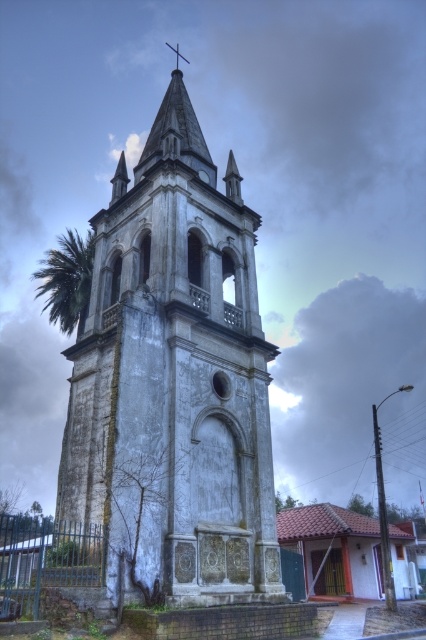
Question: Is green leafy palm at left above metallic cross at upper center?

Choices:
 (A) no
 (B) yes

Answer: (A)

Question: Which of the following is the farthest from the observer?

Choices:
 (A) (69, 273)
 (B) (181, 477)

Answer: (A)

Question: Among these objects, which one is farthest from the camera?

Choices:
 (A) metallic cross at upper center
 (B) white stone tower at center
 (C) green leafy palm at left

Answer: (A)

Question: Which point is closer to the camera taking this photo?

Choices:
 (A) (39, 289)
 (B) (154, 378)

Answer: (B)

Question: Where is white stone tower at center located in relation to green leafy palm at left in the image?

Choices:
 (A) above
 (B) below

Answer: (B)

Question: Is white stone tower at center above green leafy palm at left?

Choices:
 (A) yes
 (B) no

Answer: (B)